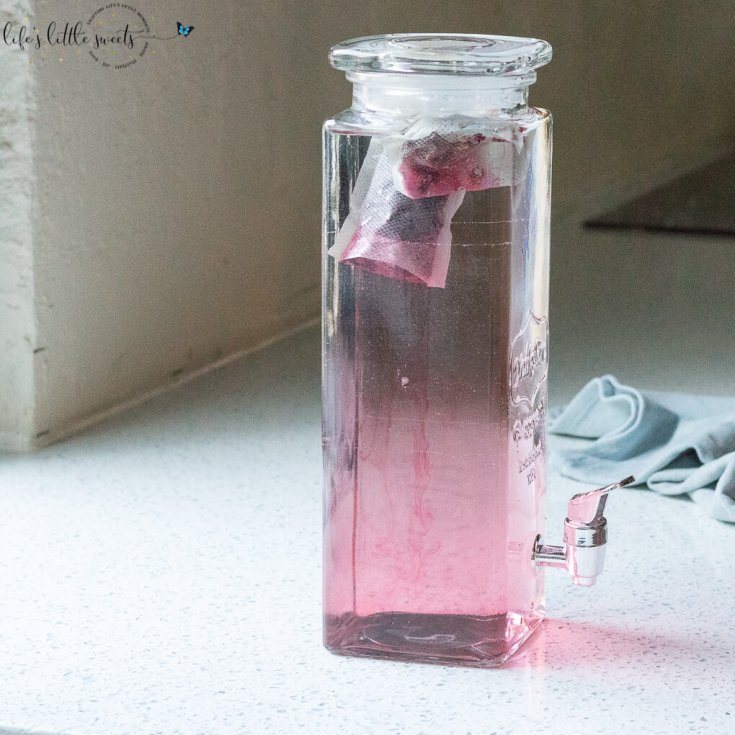
I want to click on glass top, so click(x=436, y=76).